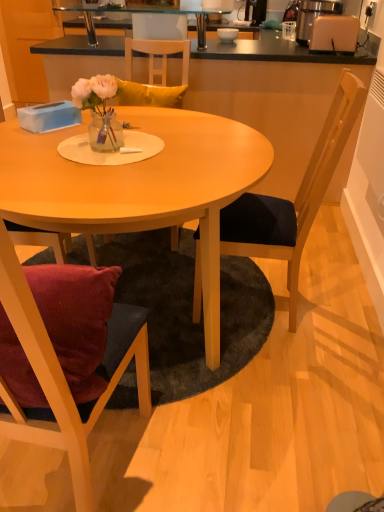
Identify the location of empty space that is to the right of black fabric chair at right, which appears as the first chair when viewed from the right. This screenshot has height=512, width=384. (340, 298).